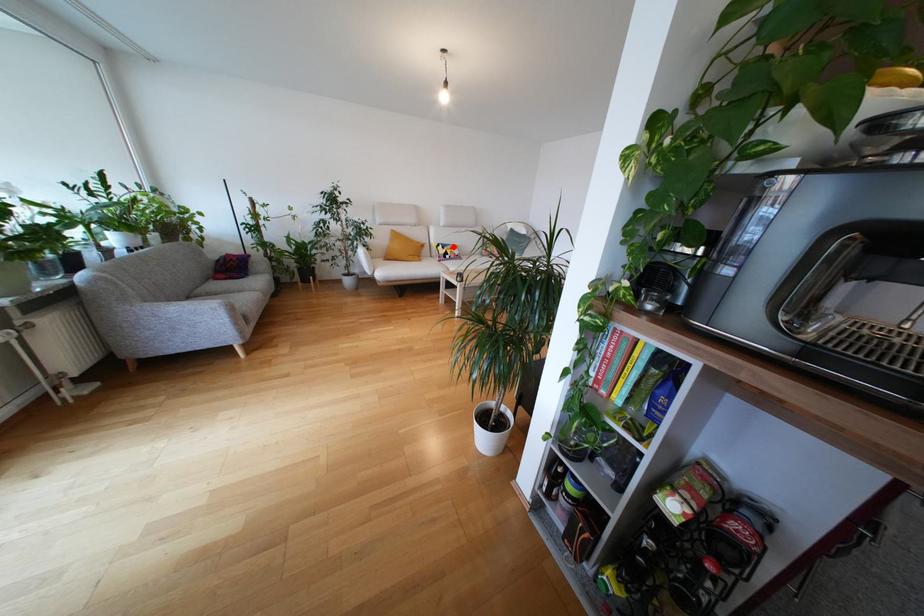
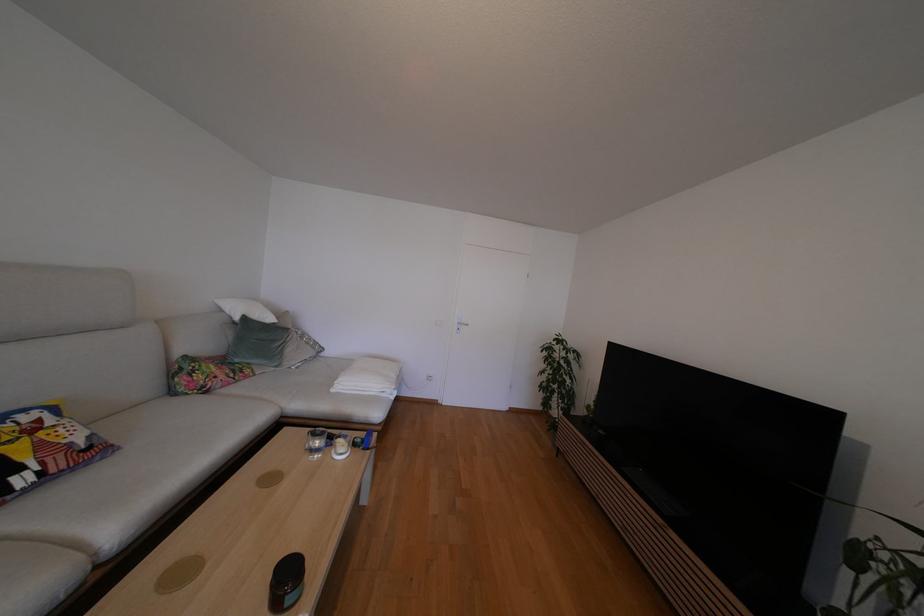
In the second image, find the point that corresponds to the highlighted location in the first image.

(6, 419)